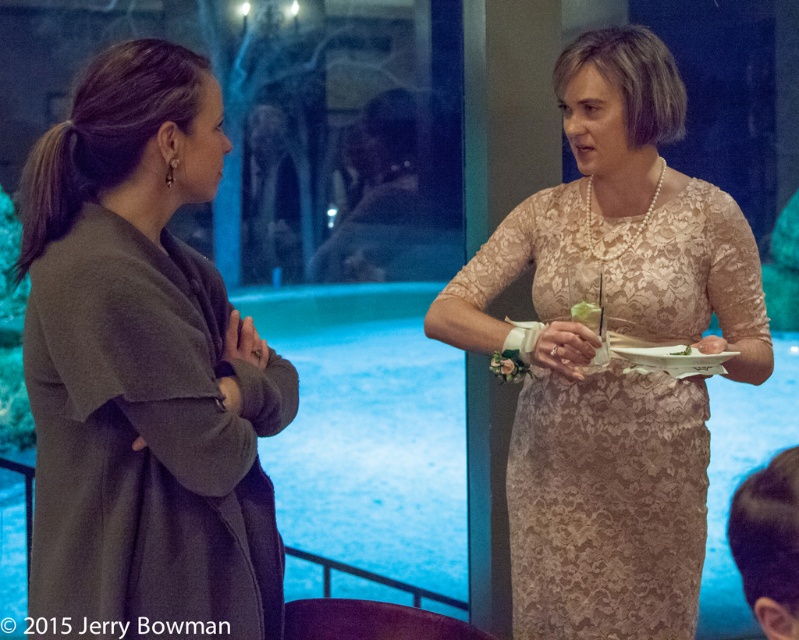
You are organizing a photo shoot and need to position two models wearing the dark gray wool coat at left and the lace dress at center. Based on the scene description, which model should you place closer to the camera to maintain the spatial relationship shown in the original image?

The dark gray wool coat at left should be placed closer to the camera because it occupies less space than the lace dress at center, which means it appears smaller and needs to be nearer to match the original spatial relationship.

You are at coordinates point 0.5, 0.2. You want to move to the dark gray wool coat at left. In which direction should you move?

Since the dark gray wool coat at left is located at point (x=142, y=371) and you are at point (x=158, y=320), you should move slightly to the right and down to reach it.

You are at a party and want to grab a snack from the green leafy vegetable at center without getting too close to the dark gray wool coat at left. Which direction should you move to reach the vegetable while avoiding the coat?

Since the dark gray wool coat at left is to the left of the green leafy vegetable at center, you should move to the right to reach the vegetable while avoiding the coat.